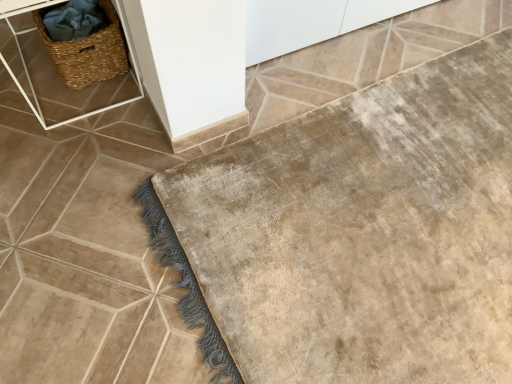
Question: Can you confirm if woven straw basket at upper left is positioned to the right of woven brown picnic basket at upper left?

Choices:
 (A) no
 (B) yes

Answer: (A)

Question: Is the position of woven straw basket at upper left less distant than that of woven brown picnic basket at upper left?

Choices:
 (A) no
 (B) yes

Answer: (B)

Question: Is the surface of woven straw basket at upper left in direct contact with woven brown picnic basket at upper left?

Choices:
 (A) yes
 (B) no

Answer: (A)

Question: Is the depth of woven straw basket at upper left greater than that of woven brown picnic basket at upper left?

Choices:
 (A) yes
 (B) no

Answer: (B)

Question: From the image's perspective, is woven straw basket at upper left located above woven brown picnic basket at upper left?

Choices:
 (A) no
 (B) yes

Answer: (B)

Question: Is woven straw basket at upper left wider than woven brown picnic basket at upper left?

Choices:
 (A) yes
 (B) no

Answer: (A)

Question: Is woven brown picnic basket at upper left in contact with woven straw basket at upper left?

Choices:
 (A) yes
 (B) no

Answer: (A)

Question: From the image's perspective, is woven brown picnic basket at upper left on woven straw basket at upper left?

Choices:
 (A) no
 (B) yes

Answer: (A)

Question: Is woven brown picnic basket at upper left further to the viewer compared to woven straw basket at upper left?

Choices:
 (A) yes
 (B) no

Answer: (A)

Question: Can you confirm if woven brown picnic basket at upper left is shorter than woven straw basket at upper left?

Choices:
 (A) no
 (B) yes

Answer: (B)

Question: Does woven brown picnic basket at upper left have a greater height compared to woven straw basket at upper left?

Choices:
 (A) yes
 (B) no

Answer: (B)

Question: Is woven brown picnic basket at upper left oriented towards woven straw basket at upper left?

Choices:
 (A) yes
 (B) no

Answer: (A)

Question: Can you confirm if beige plush bath mat at lower right is taller than woven brown picnic basket at upper left?

Choices:
 (A) no
 (B) yes

Answer: (A)